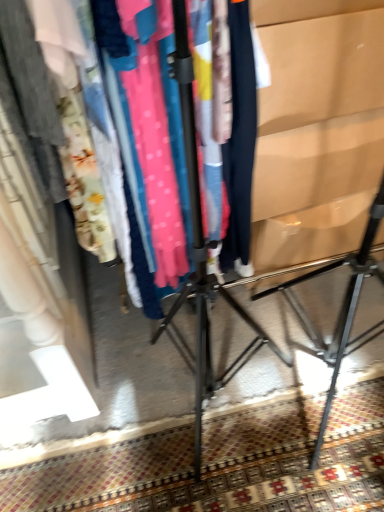
Question: From a real-world perspective, is matte cardboard at right physically located above or below carpeted floor at lower center?

Choices:
 (A) below
 (B) above

Answer: (B)

Question: In the image, is matte cardboard at right positioned in front of or behind carpeted floor at lower center?

Choices:
 (A) front
 (B) behind

Answer: (A)

Question: Considering the real-world distances, which object is farthest from the matte black clothing rack at center?

Choices:
 (A) matte cardboard at right
 (B) carpeted floor at lower center

Answer: (A)

Question: Estimate the real-world distances between objects in this image. Which object is farther from the matte cardboard at right?

Choices:
 (A) carpeted floor at lower center
 (B) matte black clothing rack at center

Answer: (B)